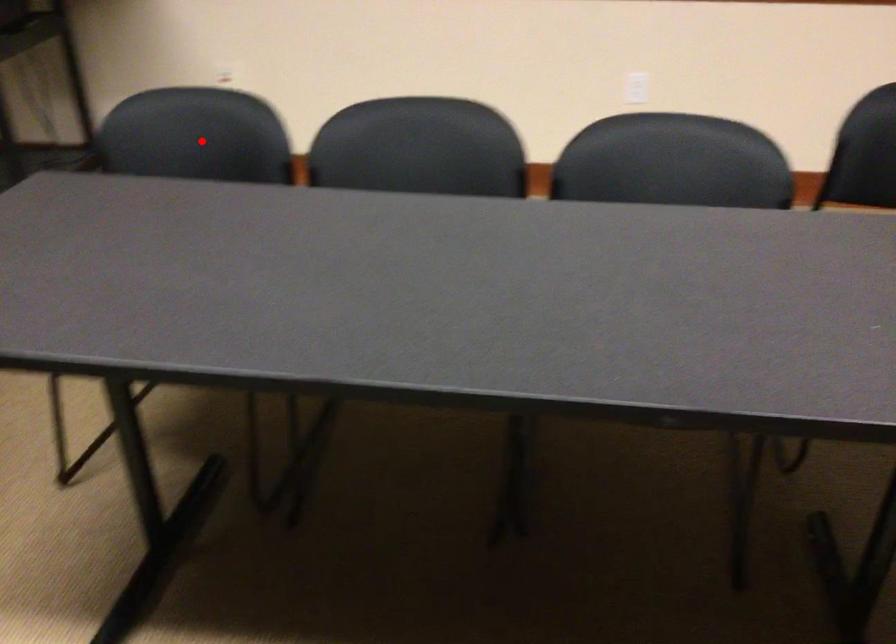
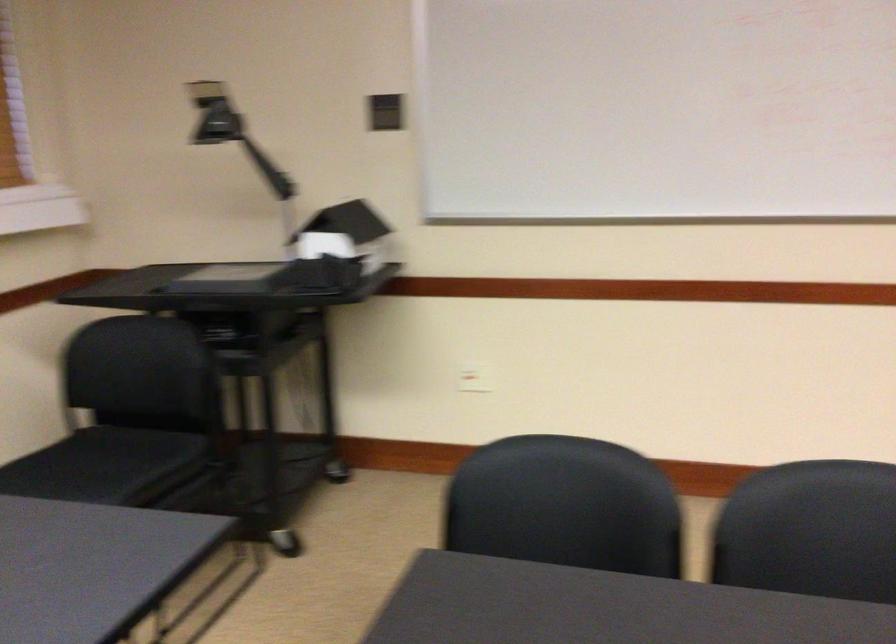
Locate, in the second image, the point that corresponds to the highlighted location in the first image.

(561, 494)